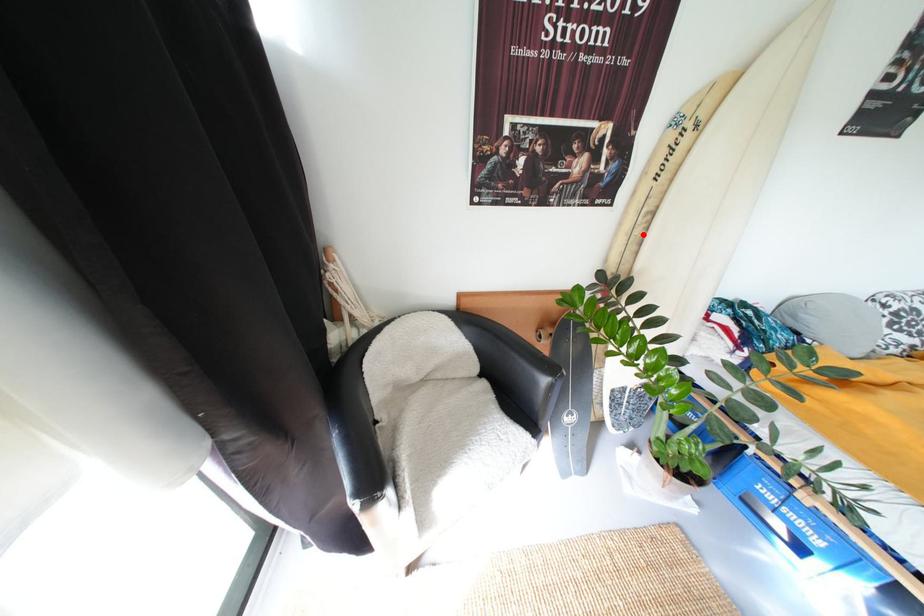
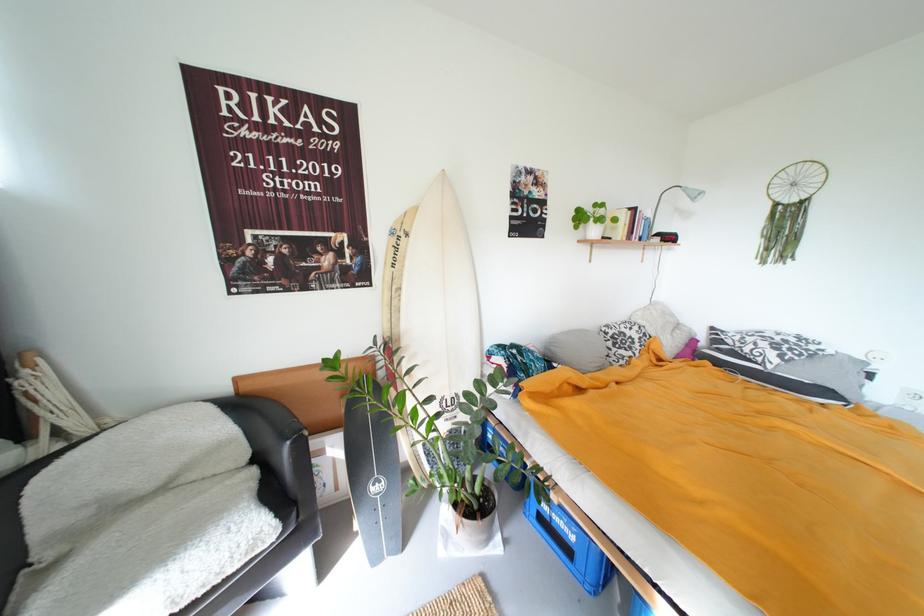
Find the pixel in the second image that matches the highlighted location in the first image.

(402, 306)